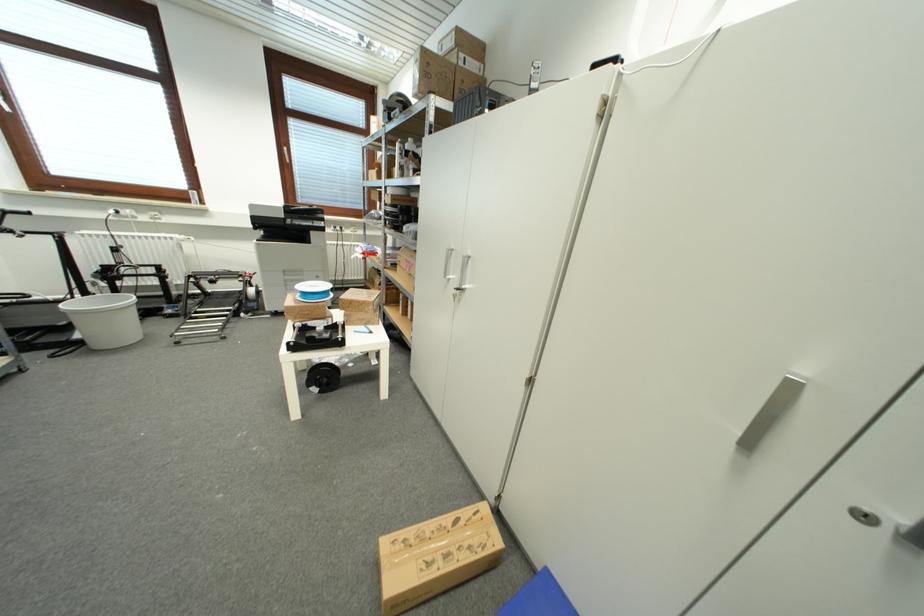
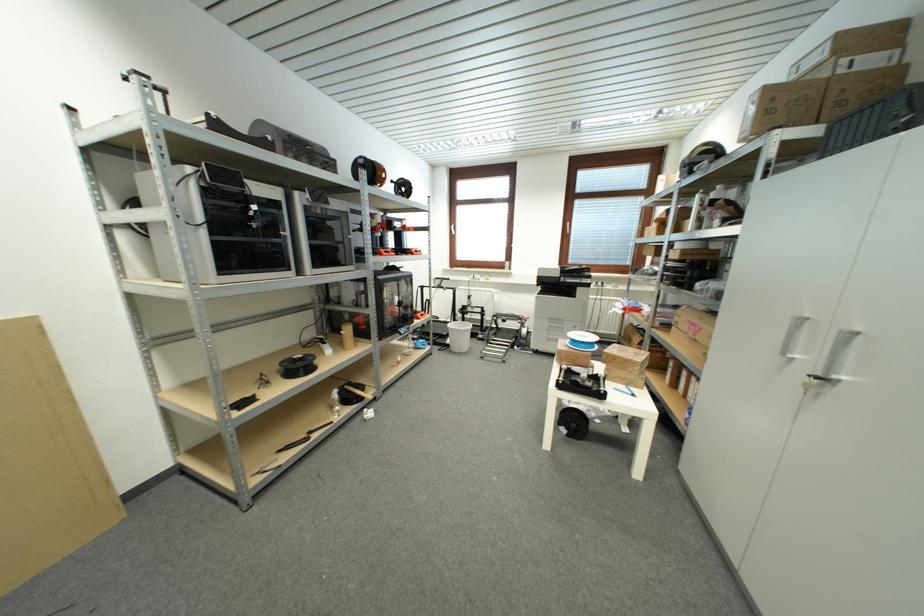
Where in the second image is the point corresponding to the point at 450,278 from the first image?

(787, 357)